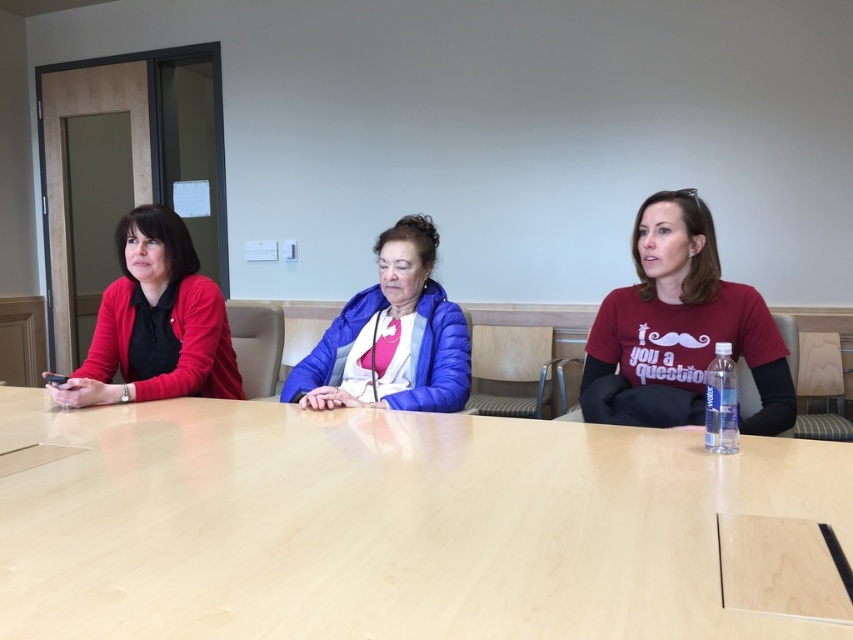
Question: Is matte red cardigan at left above blue fuzzy jacket at center?

Choices:
 (A) no
 (B) yes

Answer: (B)

Question: Does light wood table at center appear on the left side of matte red t-shirt at right?

Choices:
 (A) yes
 (B) no

Answer: (A)

Question: Which point is closer to the camera taking this photo?

Choices:
 (A) (659, 202)
 (B) (703, 465)

Answer: (B)

Question: Which point appears closest to the camera in this image?

Choices:
 (A) (712, 600)
 (B) (202, 348)
 (C) (704, 218)
 (D) (399, 396)

Answer: (A)

Question: Which point appears closest to the camera in this image?

Choices:
 (A) (354, 356)
 (B) (149, 300)
 (C) (712, 257)
 (D) (837, 474)

Answer: (D)

Question: Does matte red cardigan at left have a greater width compared to blue fuzzy jacket at center?

Choices:
 (A) no
 (B) yes

Answer: (A)